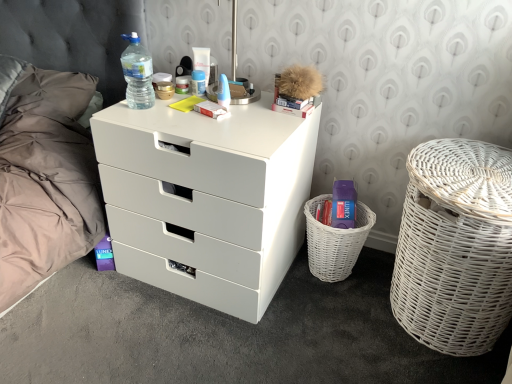
What are the coordinates of `vacant space to the right of white wicker basket at lower right` in the screenshot? It's located at (376, 269).